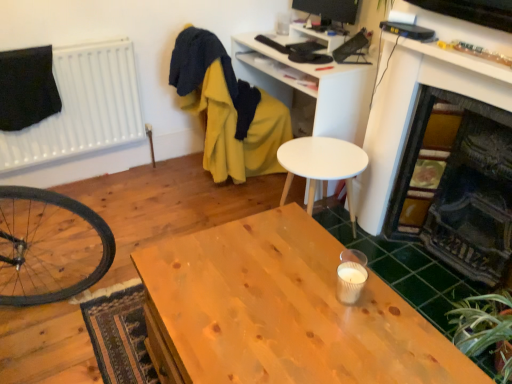
At what (x,y) coordinates should I click in order to perform the action: click on free point above black matte radiator at upper left (from a real-world perspective). Please return your answer as a coordinate pair (x, y). Looking at the image, I should click on (56, 37).